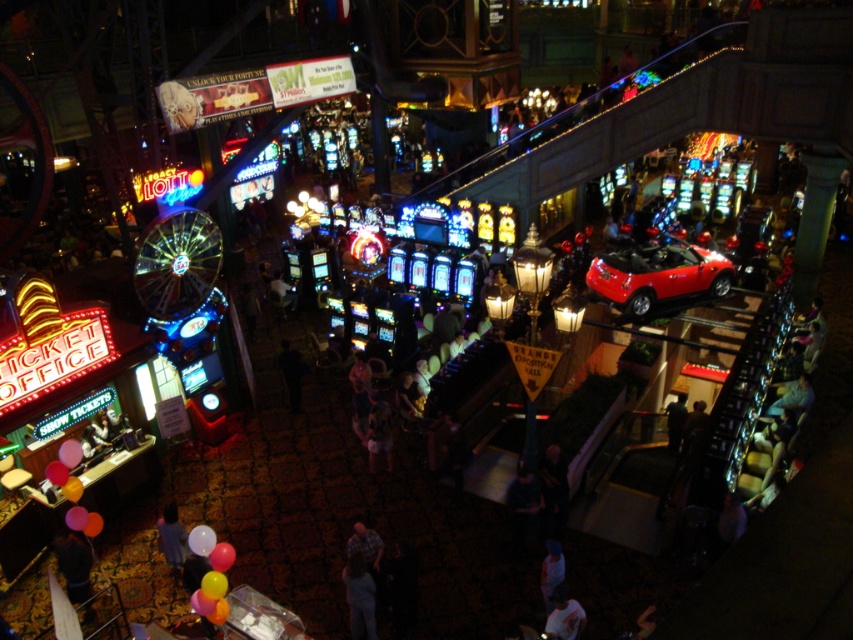
Question: Which of the following is the farthest from the observer?

Choices:
 (A) (83, 518)
 (B) (631, 304)
 (C) (212, 548)

Answer: (B)

Question: Among these objects, which one is farthest from the camera?

Choices:
 (A) rubber balloon at lower center
 (B) rubber balloons at lower left
 (C) shiny red convertible at center

Answer: (C)

Question: Can you confirm if dark blue shirt at lower center is bigger than rubber balloons at lower left?

Choices:
 (A) no
 (B) yes

Answer: (B)

Question: Is shiny red convertible at center positioned at the back of rubber balloon at lower center?

Choices:
 (A) yes
 (B) no

Answer: (A)

Question: Is light blue fabric shirt at lower left smaller than rubber balloons at lower left?

Choices:
 (A) no
 (B) yes

Answer: (A)

Question: Which object is farther from the camera taking this photo?

Choices:
 (A) rubber balloon at lower center
 (B) translucent rubber balloon at lower left

Answer: (A)